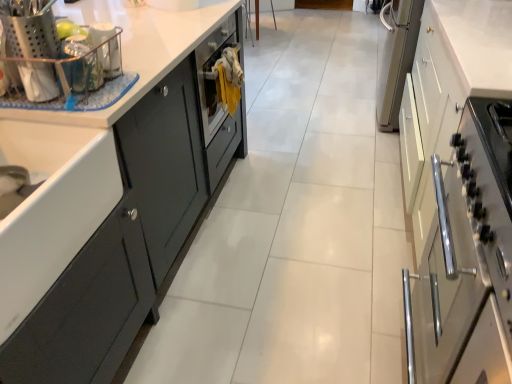
The image size is (512, 384). Identify the location of space that is in front of metallic wire basket at upper left, which appears as the first appliance when viewed from the right. (106, 86).